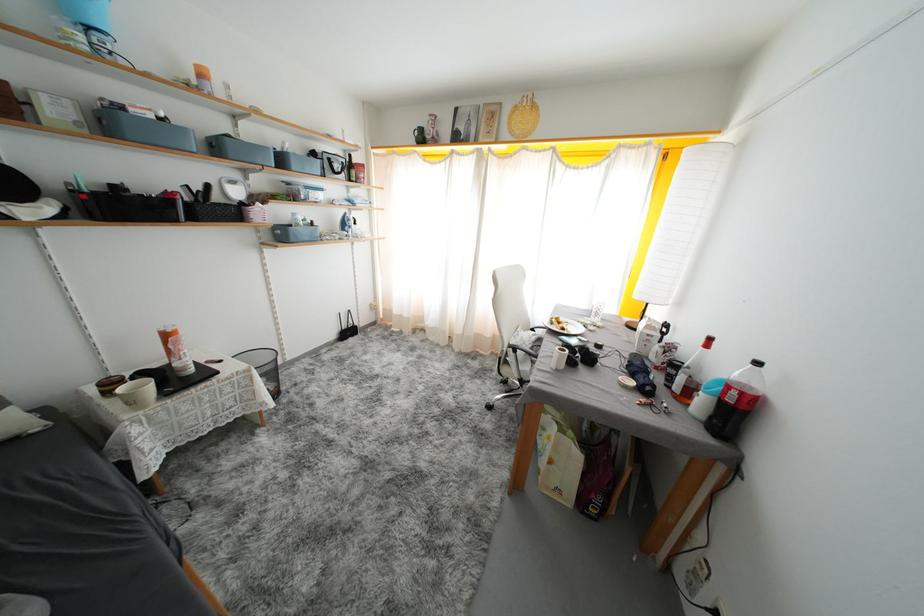
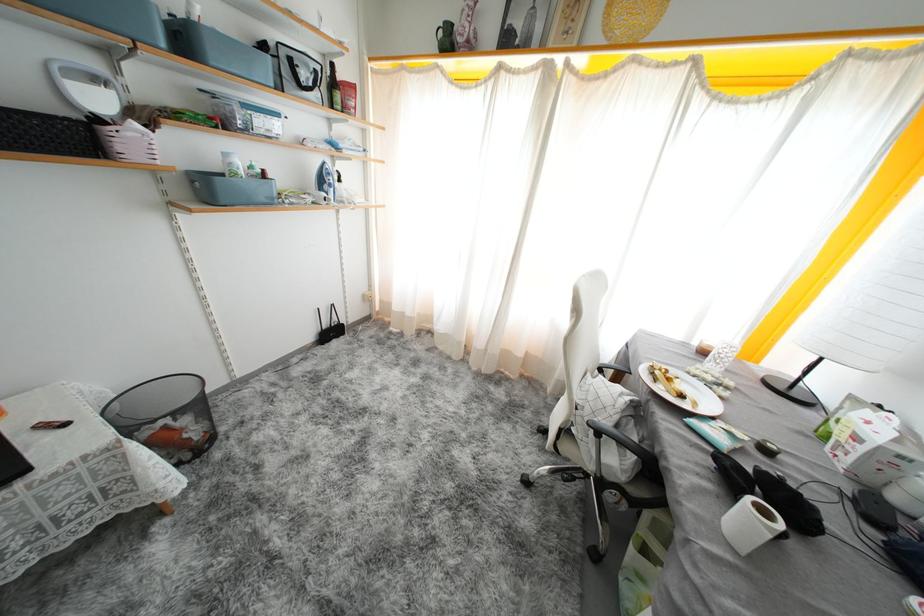
Question: In a continuous first-person perspective shot, in which direction is the camera moving?

Choices:
 (A) Left
 (B) Right
 (C) Forward
 (D) Backward

Answer: (C)